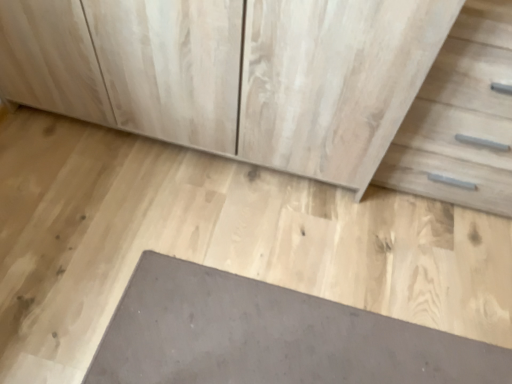
Find the location of a particular element. This screenshot has height=384, width=512. vacant region below slate at lower center (from a real-world perspective) is located at coordinates (285, 342).